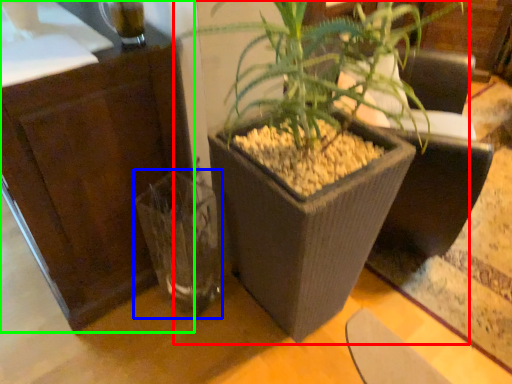
Question: Which object is positioned closest to houseplant (highlighted by a red box)? Select from vase (highlighted by a blue box) and dresser (highlighted by a green box).

Choices:
 (A) vase
 (B) dresser

Answer: (A)